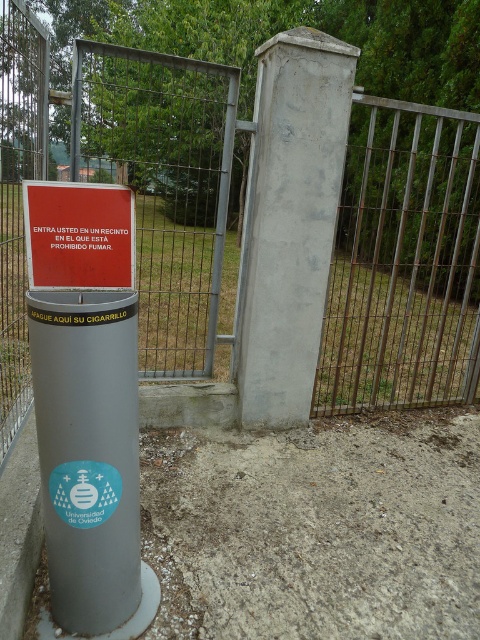
Is metallic gate at center below red matte sign at center?

Actually, metallic gate at center is above red matte sign at center.

Is metallic gate at center to the left of red matte sign at center from the viewer's perspective?

Indeed, metallic gate at center is positioned on the left side of red matte sign at center.

This screenshot has width=480, height=640. I want to click on metallic gate at center, so 404,260.